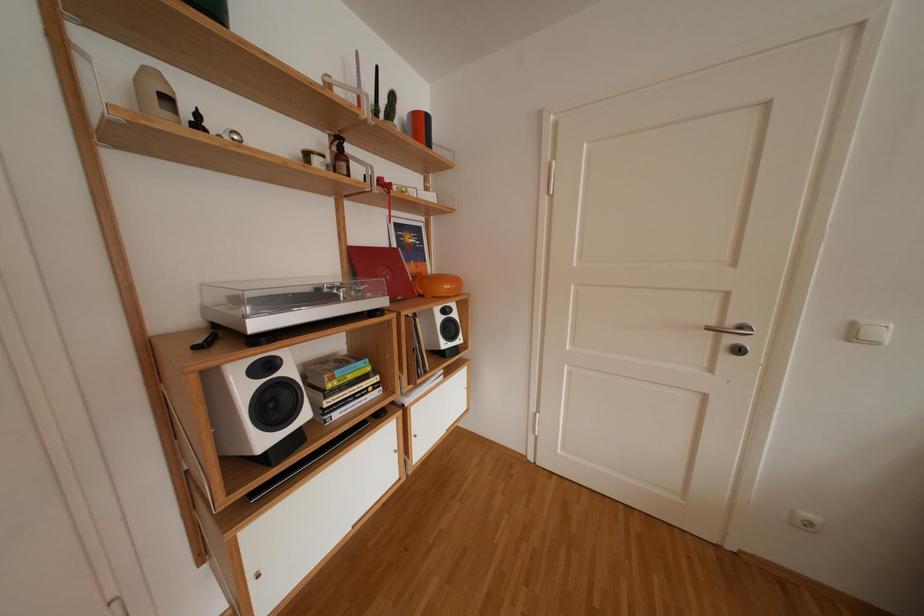
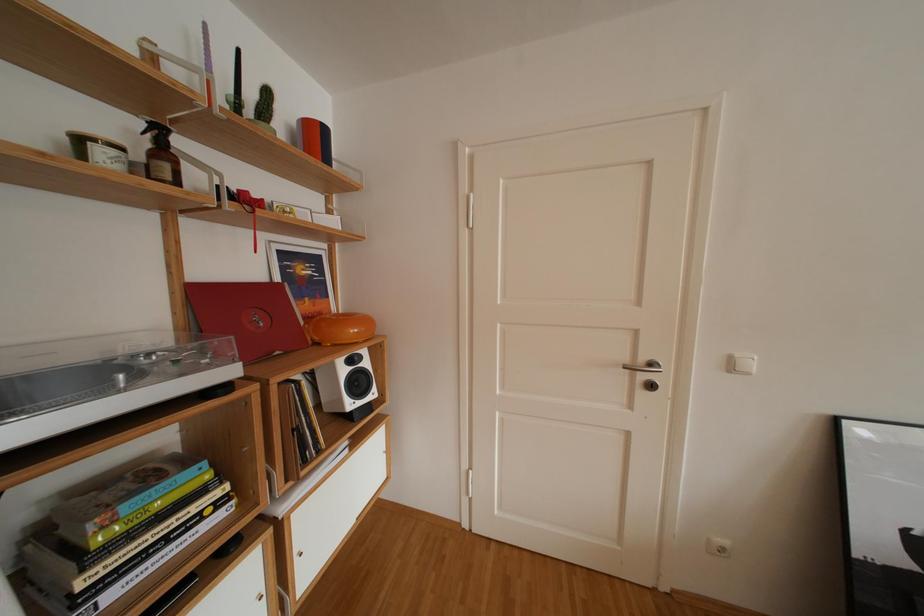
In a continuous first-person perspective shot, in which direction is the camera moving?

The cameraman moved toward right, forward.